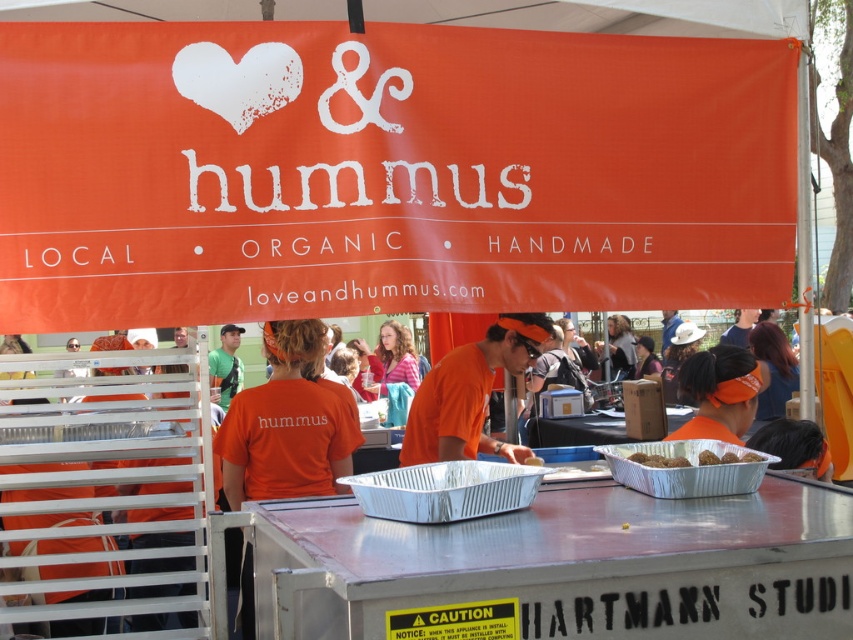
Question: Which of the following is the farthest from the observer?

Choices:
 (A) (654, 458)
 (B) (643, 452)
 (C) (67, 272)

Answer: (C)

Question: Among these objects, which one is nearest to the camera?

Choices:
 (A) brown matte meatballs at center
 (B) orange fabric shirt at center
 (C) brown matte balls at center

Answer: (A)

Question: Which of these objects is positioned closest to the orange fabric shirt at center?

Choices:
 (A) orange fabric canopy at upper center
 (B) brown matte balls at center
 (C) brown matte meatballs at center

Answer: (A)

Question: Is orange fabric shirt at center to the right of brown matte balls at center from the viewer's perspective?

Choices:
 (A) yes
 (B) no

Answer: (B)

Question: Can you confirm if orange fabric shirt at center is positioned to the left of brown matte balls at center?

Choices:
 (A) no
 (B) yes

Answer: (B)

Question: Can you confirm if orange fabric canopy at upper center is smaller than brown matte balls at center?

Choices:
 (A) yes
 (B) no

Answer: (B)